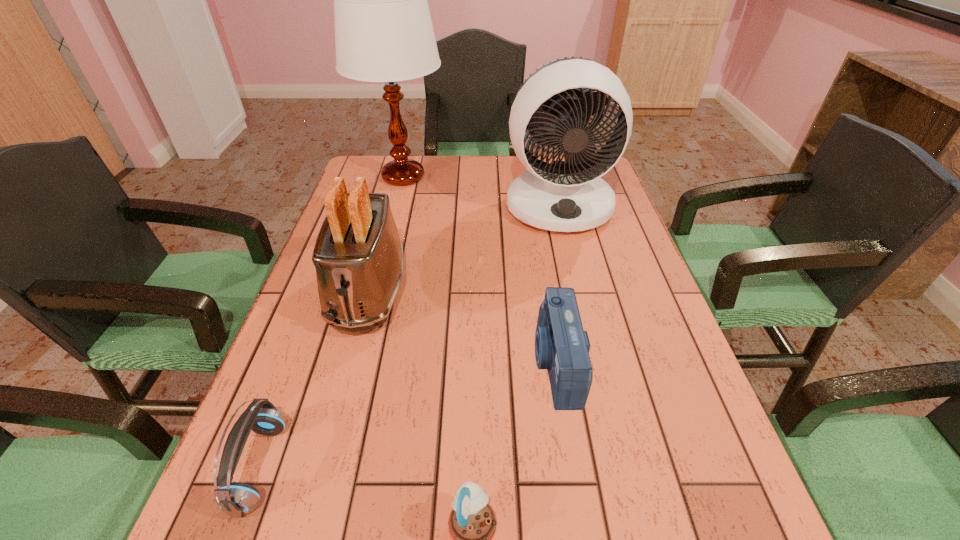
In order to click on vacant space located 0.390m on the lens of the camera in this screenshot , I will do `click(345, 363)`.

Locate an element on the screen. Image resolution: width=960 pixels, height=540 pixels. vacant space located on the ear cups of the headset is located at coordinates (503, 467).

Locate an element on the screen. This screenshot has height=540, width=960. table lamp present at the far edge is located at coordinates (383, 29).

Locate an element on the screen. This screenshot has height=540, width=960. fan present at the far edge is located at coordinates (566, 196).

Image resolution: width=960 pixels, height=540 pixels. Identify the location of table lamp located at the left edge. (383, 29).

Identify the location of toaster situated at the left edge. The image size is (960, 540). (358, 256).

Identify the location of headset present at the left edge. (236, 499).

The height and width of the screenshot is (540, 960). I want to click on object that is at the right edge, so click(566, 196).

Find the location of a particular element. This screenshot has width=960, height=540. object that is at the far left corner is located at coordinates (383, 29).

Where is `object that is at the far right corner`? object that is at the far right corner is located at coordinates (566, 196).